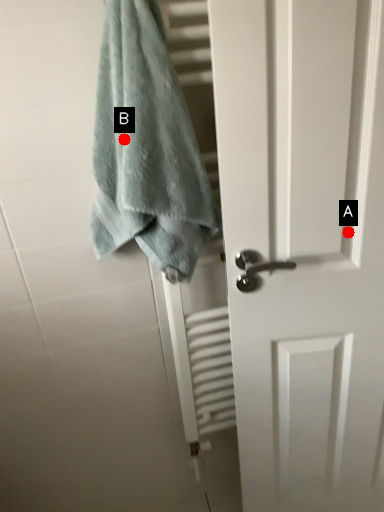
Question: Two points are circled on the image, labeled by A and B beside each circle. Which point is farther to the camera?

Choices:
 (A) A is further
 (B) B is further

Answer: (A)